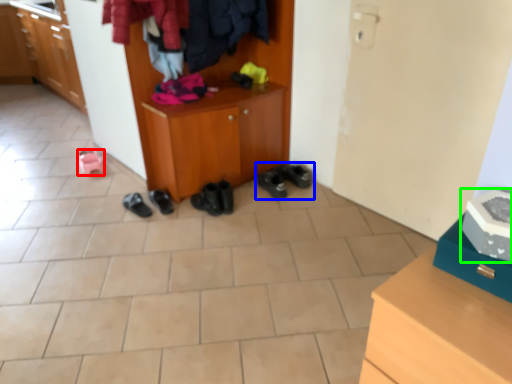
Question: Which object is positioned closest to footwear (highlighted by a red box)? Select from footwear (highlighted by a blue box) and shoe (highlighted by a green box).

Choices:
 (A) footwear
 (B) shoe

Answer: (A)